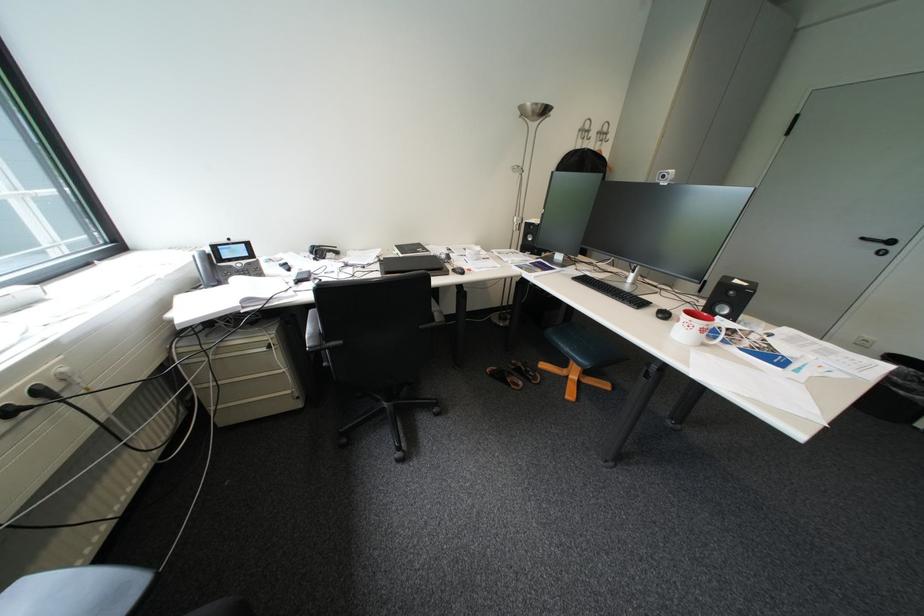
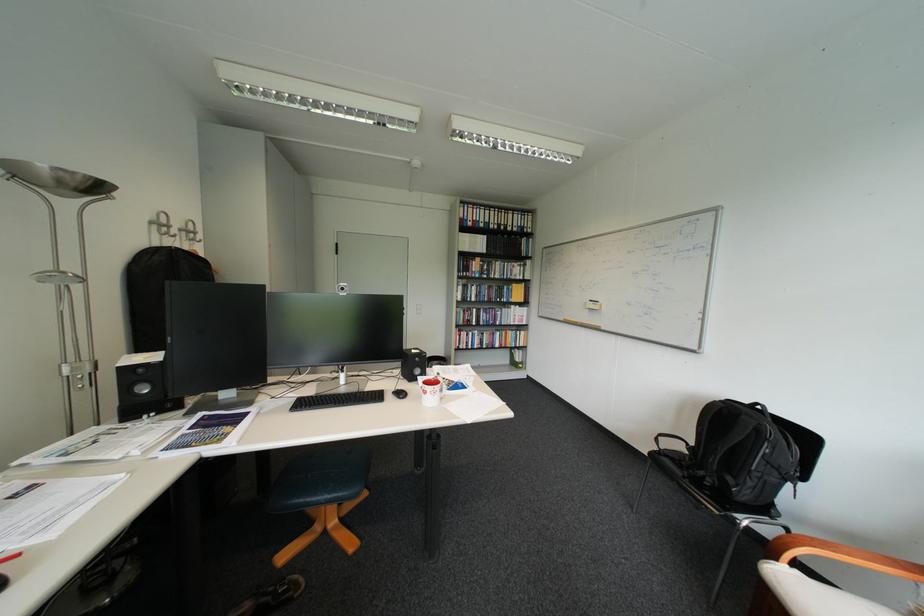
Find the pixel in the second image that matches point (627, 288) in the first image.

(357, 394)